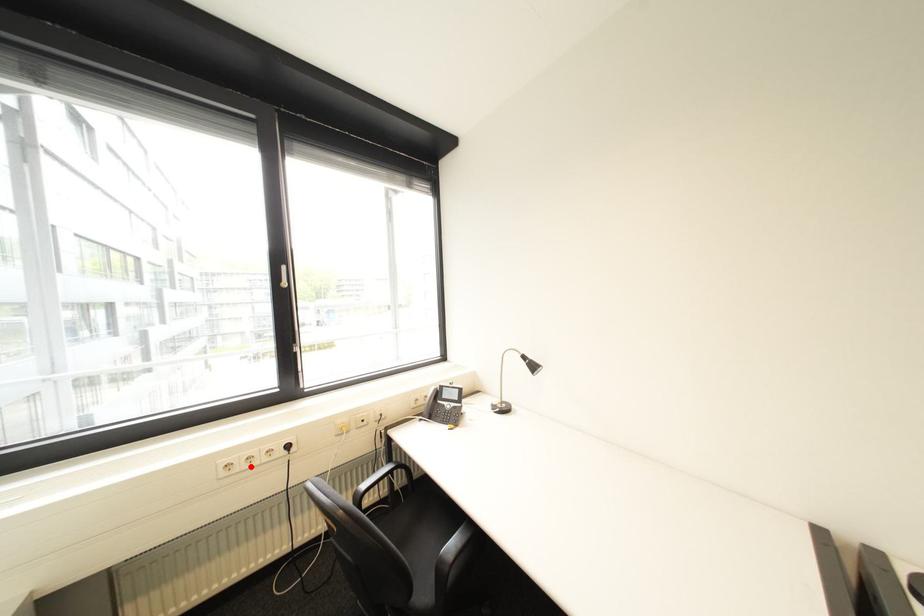
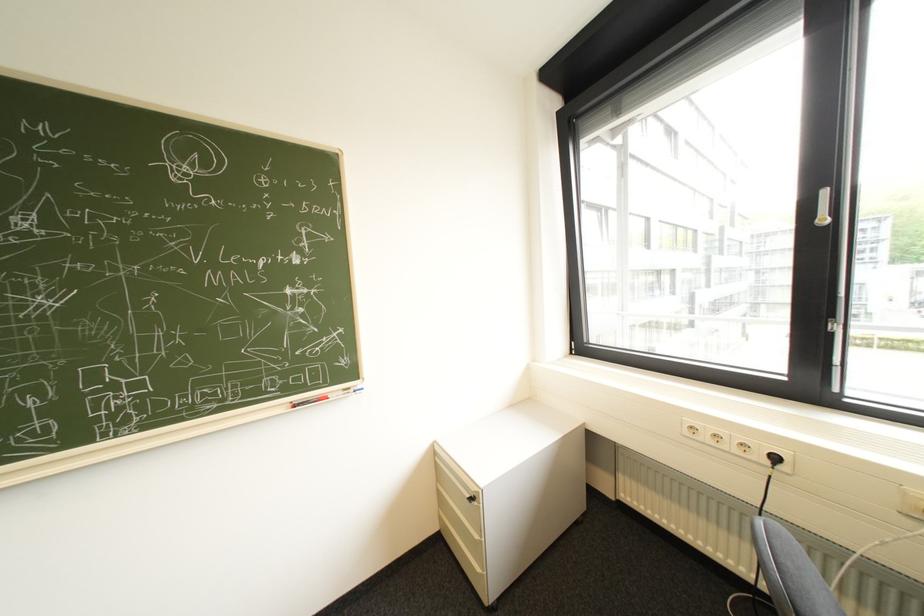
Where in the second image is the point corresponding to the highlighted location from the first image?

(715, 438)